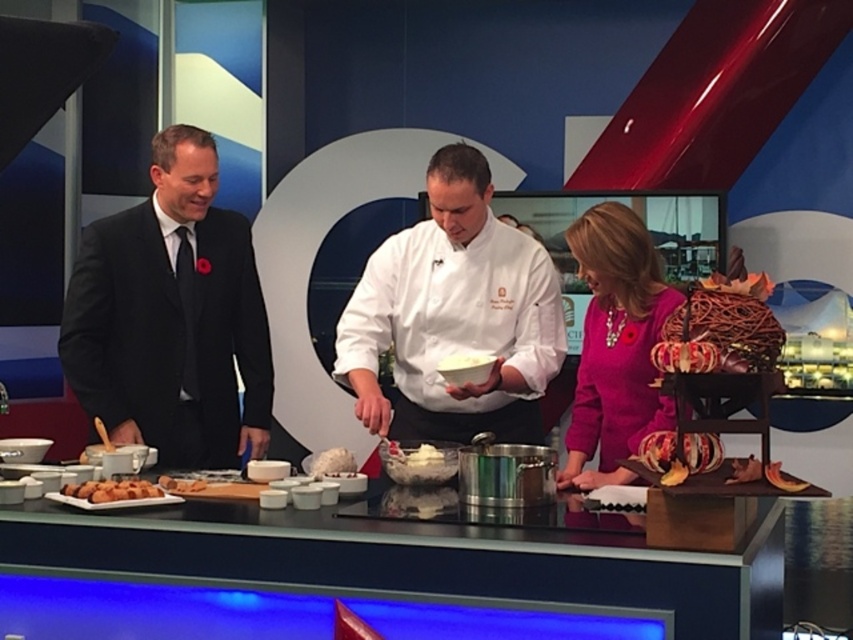
You are standing at the center of the studio and want to hand a recipe card to both the black suit at left and the chef in white coat in the center. If you walk straight ahead, will you reach both of them without changing direction?

The black suit at left and the chef in white coat in the center are 9.47 feet apart. Since you are at the center, walking straight ahead would allow you to reach both as they are positioned along the same line from your starting point.

You are a camera operator adjusting your shot to focus on the purple fabric dress at center and the shiny metallic bowl at center. Which object should you position higher in the frame?

The purple fabric dress at center should be positioned higher in the frame since it is located above the shiny metallic bowl at center.